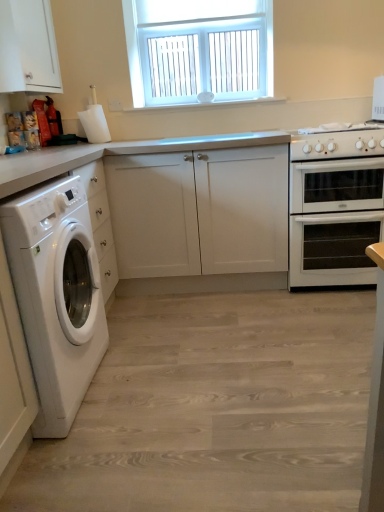
Where is `white plastic window at upper center`? The image size is (384, 512). white plastic window at upper center is located at coordinates (199, 49).

Image resolution: width=384 pixels, height=512 pixels. What do you see at coordinates (199, 49) in the screenshot?
I see `white plastic window at upper center` at bounding box center [199, 49].

The height and width of the screenshot is (512, 384). What do you see at coordinates (335, 221) in the screenshot? I see `white glossy oven at right` at bounding box center [335, 221].

The image size is (384, 512). In order to click on white glossy washing machine at left in this screenshot , I will do `click(56, 296)`.

What do you see at coordinates (337, 142) in the screenshot?
I see `white glossy gas stove at right` at bounding box center [337, 142].

The image size is (384, 512). What do you see at coordinates (28, 47) in the screenshot? I see `white matte cabinet at upper left, placed as the 1th cabinetry when sorted from top to bottom` at bounding box center [28, 47].

Describe the element at coordinates (199, 212) in the screenshot. I see `white matte cabinet at left, the 1th cabinetry in the bottom-to-top sequence` at that location.

The height and width of the screenshot is (512, 384). Find the location of `white plastic window at upper center`. white plastic window at upper center is located at coordinates (199, 49).

Consider the image. Considering the sizes of white glossy gas stove at right and white plastic window at upper center in the image, is white glossy gas stove at right taller or shorter than white plastic window at upper center?

Clearly, white glossy gas stove at right is shorter compared to white plastic window at upper center.

You are a GUI agent. You are given a task and a screenshot of the screen. Output one action in this format:
    pyautogui.click(x=<x>, y=<y>)
    Task: Click on the window located on the left of white glossy gas stove at right
    Image resolution: width=384 pixels, height=512 pixels.
    Given the screenshot: What is the action you would take?
    pyautogui.click(x=199, y=49)

Which object is more forward, white glossy gas stove at right or white plastic window at upper center?

white glossy gas stove at right is in front.

In the image, is white glossy gas stove at right on the left side or the right side of white plastic window at upper center?

Clearly, white glossy gas stove at right is on the right of white plastic window at upper center in the image.

From the image's perspective, which object appears higher, white glossy washing machine at left or white glossy oven at right?

white glossy oven at right.

Is white glossy oven at right a part of white glossy washing machine at left?

No, white glossy oven at right is located outside of white glossy washing machine at left.

Considering the relative positions of white glossy washing machine at left and white glossy oven at right in the image provided, is white glossy washing machine at left behind white glossy oven at right?

No, white glossy washing machine at left is closer to the camera.

Does white glossy washing machine at left have a smaller size compared to white glossy oven at right?

Actually, white glossy washing machine at left might be larger than white glossy oven at right.

Where is `oven below the white plastic window at upper center (from the image's perspective)`? The image size is (384, 512). oven below the white plastic window at upper center (from the image's perspective) is located at coordinates pyautogui.click(x=335, y=221).

Does white plastic window at upper center contain white glossy oven at right?

No, white glossy oven at right is not surrounded by white plastic window at upper center.

Is white plastic window at upper center to the left of white glossy oven at right from the viewer's perspective?

Indeed, white plastic window at upper center is positioned on the left side of white glossy oven at right.

From a real-world perspective, is white plastic window at upper center located higher than white glossy oven at right?

Yes.

Find the location of a particular element. The width and height of the screenshot is (384, 512). cabinetry above the white glossy gas stove at right (from the image's perspective) is located at coordinates (28, 47).

Choose the correct answer: Is white glossy gas stove at right inside white matte cabinet at upper left, acting as the second cabinetry starting from the bottom, or outside it?

white glossy gas stove at right is located beyond the bounds of white matte cabinet at upper left, acting as the second cabinetry starting from the bottom.

Who is shorter, white glossy gas stove at right or white matte cabinet at upper left, which appears as the 1th cabinetry when viewed from the left?

With less height is white glossy gas stove at right.

From the picture: Can you tell me how much white glossy gas stove at right and white matte cabinet at upper left, placed as the 1th cabinetry when sorted from top to bottom, differ in facing direction?

90.5 degrees separate the facing orientations of white glossy gas stove at right and white matte cabinet at upper left, placed as the 1th cabinetry when sorted from top to bottom.

Consider the image. Can you see white matte cabinet at left, the 1th cabinetry in the bottom-to-top sequence, touching white glossy oven at right?

No, white matte cabinet at left, the 1th cabinetry in the bottom-to-top sequence, is not in contact with white glossy oven at right.

Can you confirm if white matte cabinet at left, which appears as the second cabinetry when viewed from the top, is bigger than white glossy oven at right?

Yes, white matte cabinet at left, which appears as the second cabinetry when viewed from the top, is bigger than white glossy oven at right.

Considering the sizes of objects white matte cabinet at left, the 1th cabinetry in the bottom-to-top sequence, and white glossy oven at right in the image provided, who is shorter, white matte cabinet at left, the 1th cabinetry in the bottom-to-top sequence, or white glossy oven at right?

With less height is white glossy oven at right.

Which is in front, point (357, 218) or point (302, 153)?

The point (302, 153) is closer.

In terms of width, does white glossy oven at right look wider or thinner when compared to white glossy gas stove at right?

white glossy oven at right is wider than white glossy gas stove at right.

How much distance is there between white glossy oven at right and white glossy gas stove at right?

A distance of 13.80 inches exists between white glossy oven at right and white glossy gas stove at right.

From the image's perspective, is white glossy oven at right located above or below white glossy gas stove at right?

Based on their image positions, white glossy oven at right is located beneath white glossy gas stove at right.

What's the angular difference between white plastic window at upper center and white glossy washing machine at left's facing directions?

They differ by 89.9 degrees in their facing directions.

Is white plastic window at upper center thinner than white glossy washing machine at left?

Yes, white plastic window at upper center is thinner than white glossy washing machine at left.

Is white plastic window at upper center placed right next to white glossy washing machine at left?

No, white plastic window at upper center is not in contact with white glossy washing machine at left.

Is white plastic window at upper center to the left of white glossy washing machine at left from the viewer's perspective?

In fact, white plastic window at upper center is to the right of white glossy washing machine at left.

You are a GUI agent. You are given a task and a screenshot of the screen. Output one action in this format:
    pyautogui.click(x=<x>, y=<y>)
    Task: Click on the window that is above the white glossy gas stove at right (from a real-world perspective)
    The image size is (384, 512).
    Given the screenshot: What is the action you would take?
    pyautogui.click(x=199, y=49)

Identify the location of oven lying behind the white glossy washing machine at left. The height and width of the screenshot is (512, 384). (335, 221).

From the image, which object appears to be nearer to white plastic window at upper center, white glossy washing machine at left or white glossy oven at right?

Among the two, white glossy oven at right is located nearer to white plastic window at upper center.

Looking at the image, which one is located closer to white matte cabinet at upper left, placed as the 1th cabinetry when sorted from top to bottom, white glossy washing machine at left or white plastic window at upper center?

Based on the image, white plastic window at upper center appears to be nearer to white matte cabinet at upper left, placed as the 1th cabinetry when sorted from top to bottom.

When comparing their distances from white matte cabinet at upper left, placed as the 1th cabinetry when sorted from top to bottom, does white glossy gas stove at right or white plastic window at upper center seem further?

white glossy gas stove at right.

From the image, which object appears to be nearer to white glossy oven at right, white matte cabinet at left, which appears as the 1th cabinetry when viewed from the right, or white plastic window at upper center?

white matte cabinet at left, which appears as the 1th cabinetry when viewed from the right, is closer to white glossy oven at right.

Which object lies further to the anchor point white glossy gas stove at right, white matte cabinet at left, the 1th cabinetry in the bottom-to-top sequence, or white plastic window at upper center?

Based on the image, white plastic window at upper center appears to be further to white glossy gas stove at right.

Looking at the image, which one is located further to white glossy gas stove at right, white glossy oven at right or white glossy washing machine at left?

white glossy washing machine at left is positioned further to the anchor white glossy gas stove at right.

Estimate the real-world distances between objects in this image. Which object is further from white matte cabinet at left, the 1th cabinetry in the bottom-to-top sequence, white glossy gas stove at right or white glossy oven at right?

white glossy gas stove at right lies further to white matte cabinet at left, the 1th cabinetry in the bottom-to-top sequence, than the other object.

Based on their spatial positions, is white glossy oven at right or white matte cabinet at upper left, positioned as the 2th cabinetry in right-to-left order, closer to white glossy gas stove at right?

white glossy oven at right is positioned closer to the anchor white glossy gas stove at right.

Where is `gas stove situated between white glossy washing machine at left and white glossy oven at right from left to right`? gas stove situated between white glossy washing machine at left and white glossy oven at right from left to right is located at coordinates (337, 142).

Find the location of a particular element. cabinetry between white matte cabinet at upper left, positioned as the 2th cabinetry in right-to-left order, and white glossy washing machine at left vertically is located at coordinates (199, 212).

At what (x,y) coordinates should I click in order to perform the action: click on gas stove located between white matte cabinet at left, which appears as the second cabinetry when viewed from the top, and white glossy oven at right in the left-right direction. Please return your answer as a coordinate pair (x, y). The height and width of the screenshot is (512, 384). Looking at the image, I should click on (337, 142).

This screenshot has width=384, height=512. Identify the location of gas stove between white matte cabinet at upper left, placed as the 1th cabinetry when sorted from top to bottom, and white glossy oven at right. (337, 142).